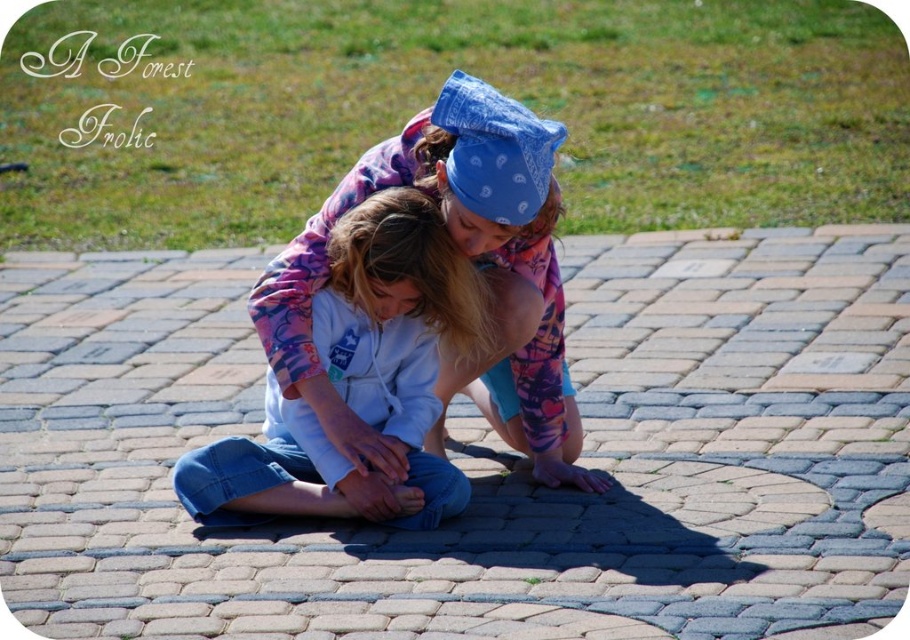
Question: Is brick pavement at center positioned at the back of blue denim jeans at center?

Choices:
 (A) no
 (B) yes

Answer: (A)

Question: Can you confirm if brick pavement at center is positioned to the left of floral fleece jacket at center?

Choices:
 (A) yes
 (B) no

Answer: (B)

Question: Does brick pavement at center appear on the right side of blue denim jeans at center?

Choices:
 (A) no
 (B) yes

Answer: (B)

Question: Among these points, which one is farthest from the camera?

Choices:
 (A) (370, 278)
 (B) (644, 515)
 (C) (287, 392)

Answer: (C)

Question: Which of the following is the farthest from the observer?

Choices:
 (A) (395, 150)
 (B) (325, 301)

Answer: (A)

Question: Which point is farther from the camera taking this photo?

Choices:
 (A) (305, 428)
 (B) (306, 352)

Answer: (A)